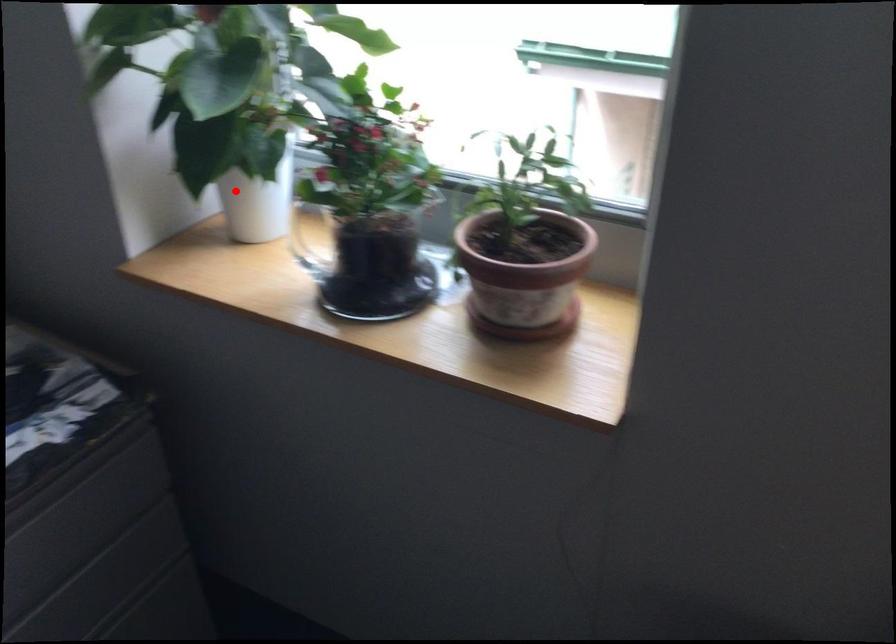
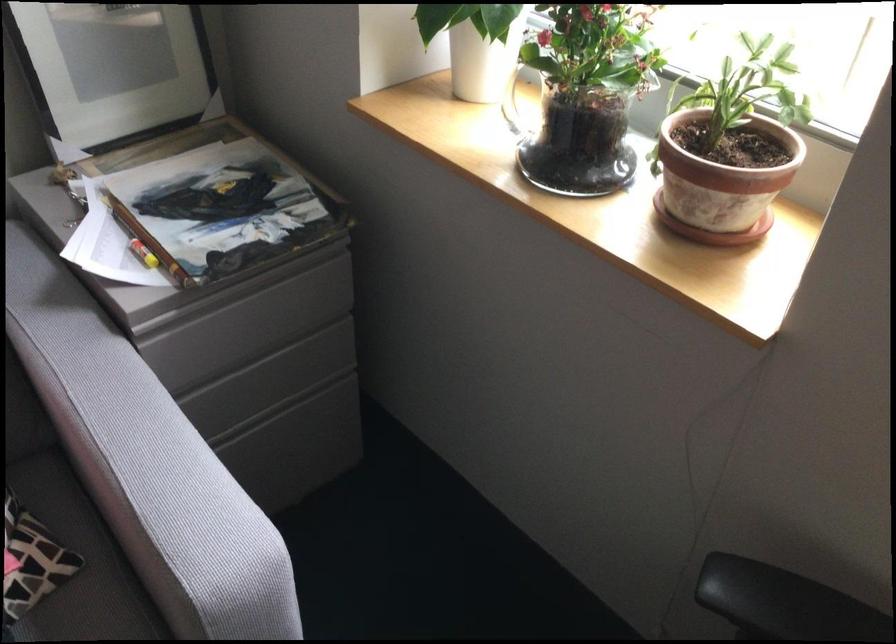
In the second image, find the point that corresponds to the highlighted location in the first image.

(467, 44)